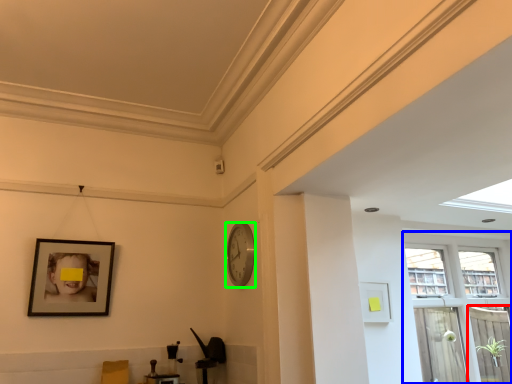
Question: Which is farther away from screen door (highlighted by a red box)? window (highlighted by a blue box) or clock (highlighted by a green box)?

Choices:
 (A) window
 (B) clock

Answer: (B)